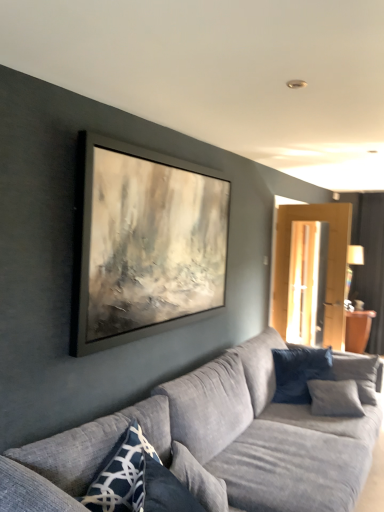
Question: Based on their sizes in the image, would you say dark blue textured pillow at right, the first pillow when ordered from right to left, is bigger or smaller than textured gray couch at center?

Choices:
 (A) small
 (B) big

Answer: (A)

Question: Is point (365, 373) positioned closer to the camera than point (226, 487)?

Choices:
 (A) closer
 (B) farther

Answer: (B)

Question: Which of these objects is positioned closest to the textured gray couch at center?

Choices:
 (A) dark blue fabric pillow at right, acting as the second pillow starting from the left
 (B) dark blue textured pillow at right, which ranks as the third pillow in left-to-right order
 (C) blue textured pillow at lower left, the third pillow from the right

Answer: (C)

Question: Considering the real-world distances, which object is farthest from the blue textured pillow at lower left, the 1th pillow when ordered from left to right?

Choices:
 (A) textured gray couch at center
 (B) dark blue fabric pillow at right, positioned as the 1th pillow in back-to-front order
 (C) dark blue textured pillow at right, which ranks as the third pillow in left-to-right order

Answer: (C)